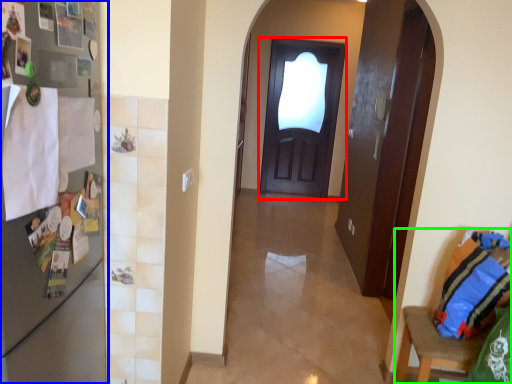
Question: Based on their relative distances, which object is farther from door (highlighted by a red box)? Choose from fridge (highlighted by a blue box) and armchair (highlighted by a green box).

Choices:
 (A) fridge
 (B) armchair

Answer: (A)